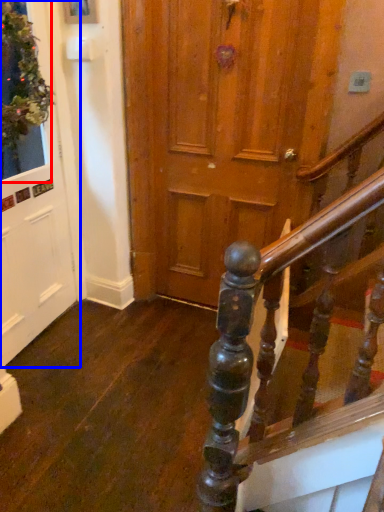
Question: Which of the following is the farthest to the observer, window (highlighted by a red box) or door (highlighted by a blue box)?

Choices:
 (A) window
 (B) door

Answer: (B)